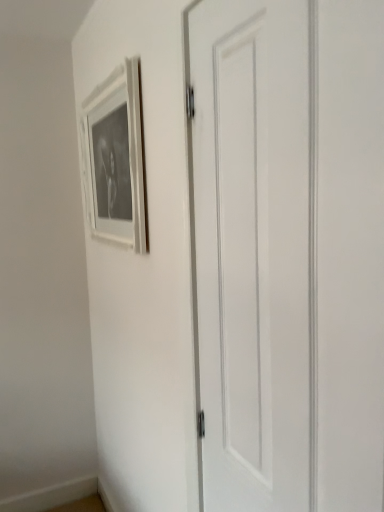
Identify the location of white matte picture frame at upper left. The image size is (384, 512). (115, 158).

Describe the element at coordinates (115, 158) in the screenshot. This screenshot has width=384, height=512. I see `white matte picture frame at upper left` at that location.

Measure the distance between point (x=265, y=383) and camera.

Point (x=265, y=383) and camera are 34.02 inches apart.

The height and width of the screenshot is (512, 384). Describe the element at coordinates (290, 251) in the screenshot. I see `white matte door at center` at that location.

Where is `white matte door at center`? white matte door at center is located at coordinates (290, 251).

Looking at this image, measure the distance between white matte door at center and camera.

The depth of white matte door at center is 21.50 inches.

You are a GUI agent. You are given a task and a screenshot of the screen. Output one action in this format:
    pyautogui.click(x=<x>, y=<y>)
    Task: Click on the white matte picture frame at upper left
    This screenshot has height=512, width=384.
    Given the screenshot: What is the action you would take?
    pyautogui.click(x=115, y=158)

Looking at this image, which is more to the right, white matte picture frame at upper left or white matte door at center?

From the viewer's perspective, white matte door at center appears more on the right side.

From the picture: Which is behind, white matte picture frame at upper left or white matte door at center?

Positioned behind is white matte picture frame at upper left.

Between point (113, 179) and point (219, 178), which one is positioned behind?

Positioned behind is point (113, 179).

In the scene shown: From the image's perspective, is white matte picture frame at upper left above or below white matte door at center?

Clearly, from the image's perspective, white matte picture frame at upper left is above white matte door at center.

From a real-world perspective, is white matte picture frame at upper left beneath white matte door at center?

No, from a real-world perspective, white matte picture frame at upper left is not below white matte door at center.

Can you confirm if white matte picture frame at upper left is wider than white matte door at center?

Correct, the width of white matte picture frame at upper left exceeds that of white matte door at center.

Is white matte picture frame at upper left taller or shorter than white matte door at center?

white matte picture frame at upper left is shorter than white matte door at center.

Is white matte picture frame at upper left bigger than white matte door at center?

Actually, white matte picture frame at upper left might be smaller than white matte door at center.

Could white matte door at center be considered to be inside white matte picture frame at upper left?

No, white matte door at center is not a part of white matte picture frame at upper left.

Is white matte picture frame at upper left beside white matte door at center?

No, white matte picture frame at upper left is not with white matte door at center.

Is white matte picture frame at upper left facing away from white matte door at center?

No, white matte picture frame at upper left is not facing away from white matte door at center.

What's the angular difference between white matte picture frame at upper left and white matte door at center's facing directions?

3.96 degrees separate the facing orientations of white matte picture frame at upper left and white matte door at center.

In the scene shown: How far apart are white matte picture frame at upper left and white matte door at center?

The distance of white matte picture frame at upper left from white matte door at center is 27.13 inches.

You are a GUI agent. You are given a task and a screenshot of the screen. Output one action in this format:
    pyautogui.click(x=<x>, y=<y>)
    Task: Click on the door located underneath the white matte picture frame at upper left (from a real-world perspective)
    The image size is (384, 512).
    Given the screenshot: What is the action you would take?
    pyautogui.click(x=290, y=251)

In the image, is white matte door at center on the left side or the right side of white matte picture frame at upper left?

Based on their positions, white matte door at center is located to the right of white matte picture frame at upper left.

Considering the relative positions of white matte door at center and white matte picture frame at upper left in the image provided, is white matte door at center in front of white matte picture frame at upper left?

Yes, white matte door at center is in front of white matte picture frame at upper left.

Which is nearer, (340, 467) or (131, 227)?

Positioned in front is point (340, 467).

From the image's perspective, between white matte door at center and white matte picture frame at upper left, who is located below?

From the image's view, white matte door at center is below.

From a real-world perspective, relative to white matte picture frame at upper left, is white matte door at center vertically above or below?

Clearly, from a real-world perspective, white matte door at center is below white matte picture frame at upper left.

Does white matte door at center have a greater width compared to white matte picture frame at upper left?

No, white matte door at center is not wider than white matte picture frame at upper left.

Does white matte door at center have a greater height compared to white matte picture frame at upper left?

Yes.

Can you confirm if white matte door at center is smaller than white matte picture frame at upper left?

Actually, white matte door at center might be larger than white matte picture frame at upper left.

Is white matte picture frame at upper left inside white matte door at center?

No, white matte door at center does not contain white matte picture frame at upper left.

Are white matte door at center and white matte picture frame at upper left far apart?

No, white matte door at center is in close proximity to white matte picture frame at upper left.

Is white matte door at center turned away from white matte picture frame at upper left?

No, white matte door at center is not facing the opposite direction of white matte picture frame at upper left.

The width and height of the screenshot is (384, 512). I want to click on picture frame above the white matte door at center (from the image's perspective), so click(x=115, y=158).

Locate an element on the screen. The height and width of the screenshot is (512, 384). door that is under the white matte picture frame at upper left (from a real-world perspective) is located at coordinates (290, 251).

The width and height of the screenshot is (384, 512). I want to click on picture frame that appears above the white matte door at center (from the image's perspective), so click(115, 158).